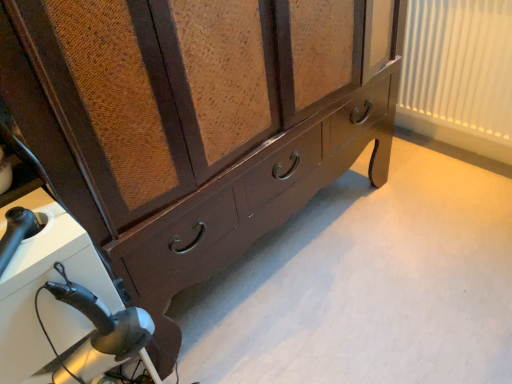
Question: From a real-world perspective, is black plastic hairdryer at lower left above or below white pleated curtain at upper right?

Choices:
 (A) below
 (B) above

Answer: (A)

Question: Looking at their shapes, would you say black plastic hairdryer at lower left is wider or thinner than white pleated curtain at upper right?

Choices:
 (A) thin
 (B) wide

Answer: (B)

Question: Is black plastic hairdryer at lower left situated inside white pleated curtain at upper right or outside?

Choices:
 (A) outside
 (B) inside

Answer: (A)

Question: In the image, is white pleated curtain at upper right positioned in front of or behind black plastic hairdryer at lower left?

Choices:
 (A) front
 (B) behind

Answer: (B)

Question: Is white pleated curtain at upper right wider or thinner than black plastic hairdryer at lower left?

Choices:
 (A) thin
 (B) wide

Answer: (A)

Question: From the image's perspective, is white pleated curtain at upper right located above or below black plastic hairdryer at lower left?

Choices:
 (A) below
 (B) above

Answer: (B)

Question: From a real-world perspective, is white pleated curtain at upper right positioned above or below black plastic hairdryer at lower left?

Choices:
 (A) above
 (B) below

Answer: (A)